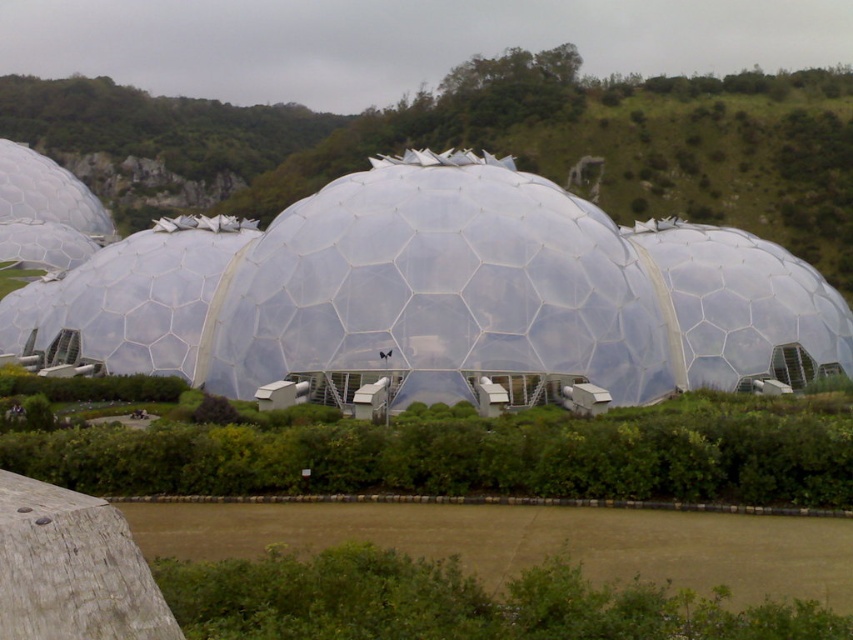
You are a visitor standing at the entrance of the Eden Project and want to take a photo of the transparent glass dome at center with the green grassy hillside at upper center in the background. Can you do that?

The transparent glass dome at center is in front of the green grassy hillside at upper center, so you can take a photo with the transparent glass dome at center in the foreground and the green grassy hillside at upper center in the background.

You are planning to install a new pathway that connects the transparent glass dome at center to the green grassy hillside at upper center. The pathway must be at least 250 feet long to accommodate all the planned features. Based on the scene description, will the existing distance between these two landmarks allow the pathway to be built without needing to extend its length?

The distance between the transparent glass dome at center and the green grassy hillside at upper center is 284.45 feet, which exceeds the minimum required length of 250 feet. Therefore, the existing distance allows the pathway to be built without needing to extend its length.

You are a visitor standing at the entrance of the Eden Project and want to take a photo of the transparent glass dome at center and the green grassy hillside at upper center. Which object should you point your camera towards first if you want to capture both in a single shot?

You should point your camera towards the green grassy hillside at upper center first because the transparent glass dome at center is to the right of it, allowing both to be captured in the same frame.